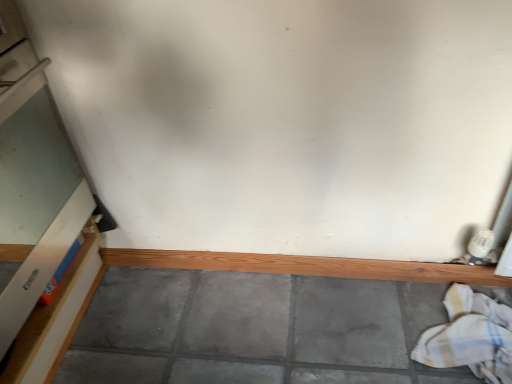
Question: Would you say white cardboard box at left is inside or outside white cotton laundry at lower right?

Choices:
 (A) inside
 (B) outside

Answer: (B)

Question: From a real-world perspective, relative to white cotton laundry at lower right, is white cardboard box at left vertically above or below?

Choices:
 (A) above
 (B) below

Answer: (A)

Question: Estimate the real-world distances between objects in this image. Which object is closer to the white cardboard box at left?

Choices:
 (A) wooden at bottom
 (B) white cotton laundry at lower right

Answer: (A)

Question: Which object is the farthest from the white cotton laundry at lower right?

Choices:
 (A) white cardboard box at left
 (B) wooden at bottom

Answer: (A)